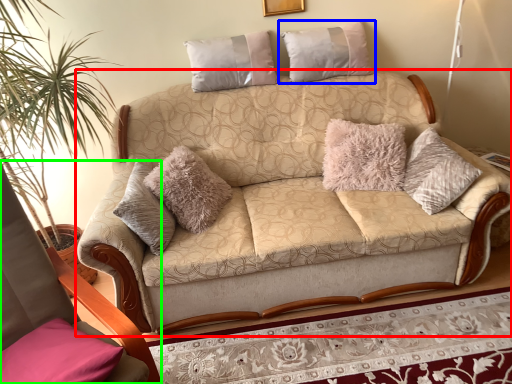
Question: Estimate the real-world distances between objects in this image. Which object is farther from studio couch (highlighted by a red box), pillow (highlighted by a blue box) or rocking chair (highlighted by a green box)?

Choices:
 (A) pillow
 (B) rocking chair

Answer: (B)